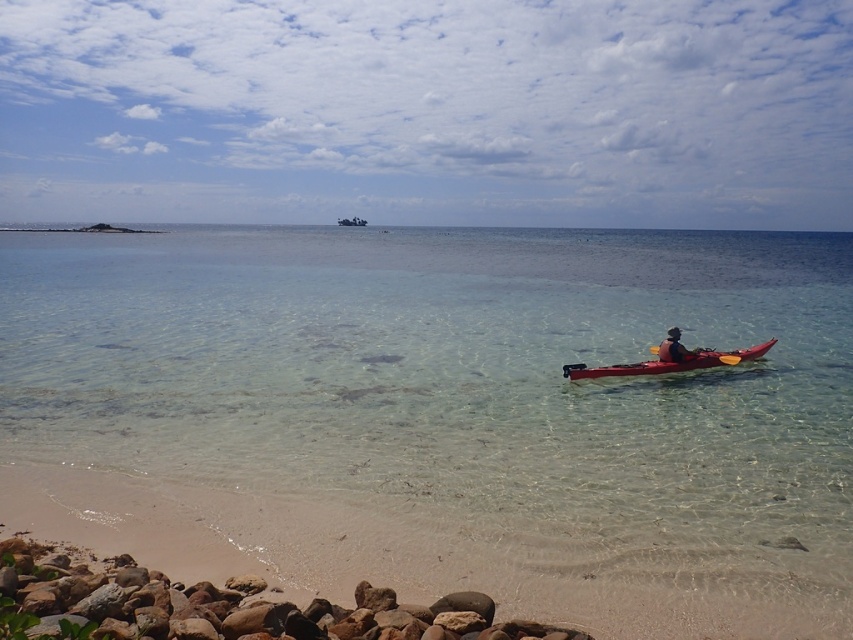
You are standing on the beach and want to reach the clear glassy water at center located at point (448, 413). The red kayak is in your way. Can you walk around the red kayak to get to the clear glassy water at center?

The clear glassy water at center is located at point (448, 413), which is the same location as the red kayak. Therefore, you cannot walk around the red kayak to reach the clear glassy water at center because they are at the same position.

You are planning to take a short swim in the area shown. Based on the scene, which of the two areas would you choose to swim in, the clear glassy water at center or the rusty stone rocks at lower left, and why?

You should choose the clear glassy water at center because it is bigger and safer for swimming compared to the rusty stone rocks at lower left which are smaller and might have sharp edges.